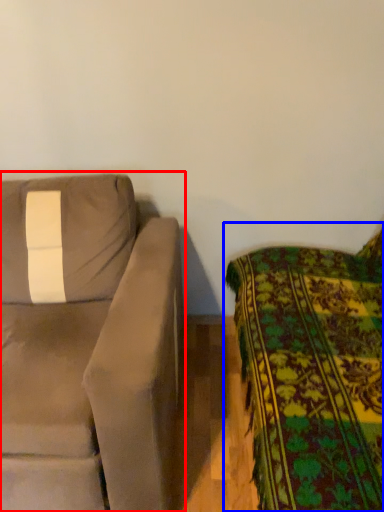
Question: Which of the following is the farthest to the observer, studio couch (highlighted by a red box) or studio couch (highlighted by a blue box)?

Choices:
 (A) studio couch
 (B) studio couch

Answer: (A)